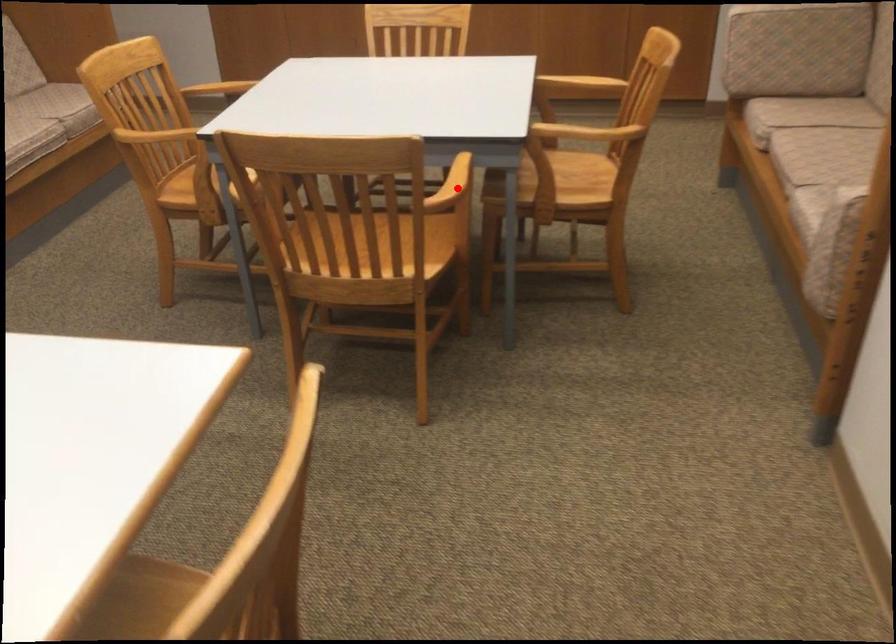
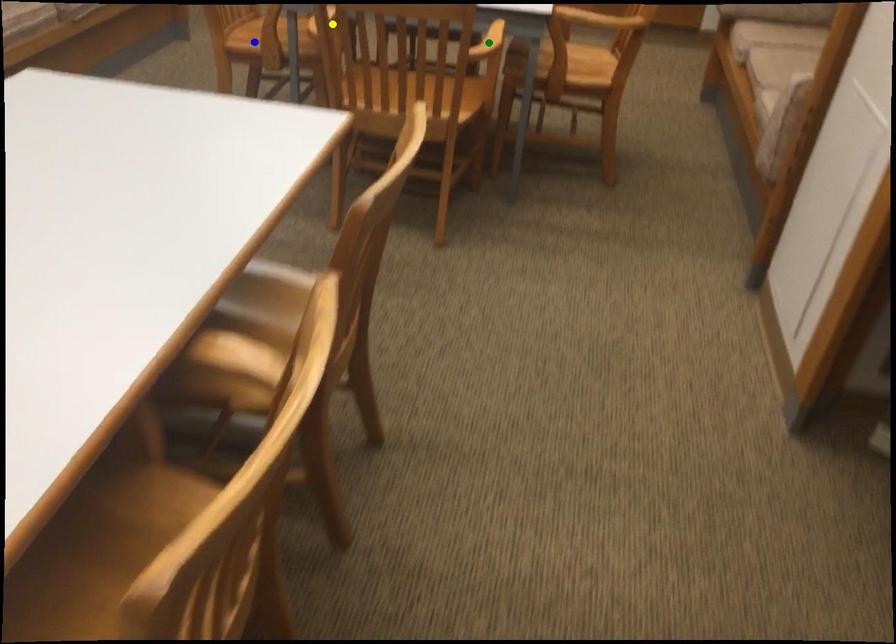
Question: I am providing you with two images of the same scene from different viewpoints. A red point is marked on the first image. You are given multiple points on the second image. Which mark in image 2 goes with the point in image 1?

Choices:
 (A) blue point
 (B) green point
 (C) yellow point

Answer: (B)